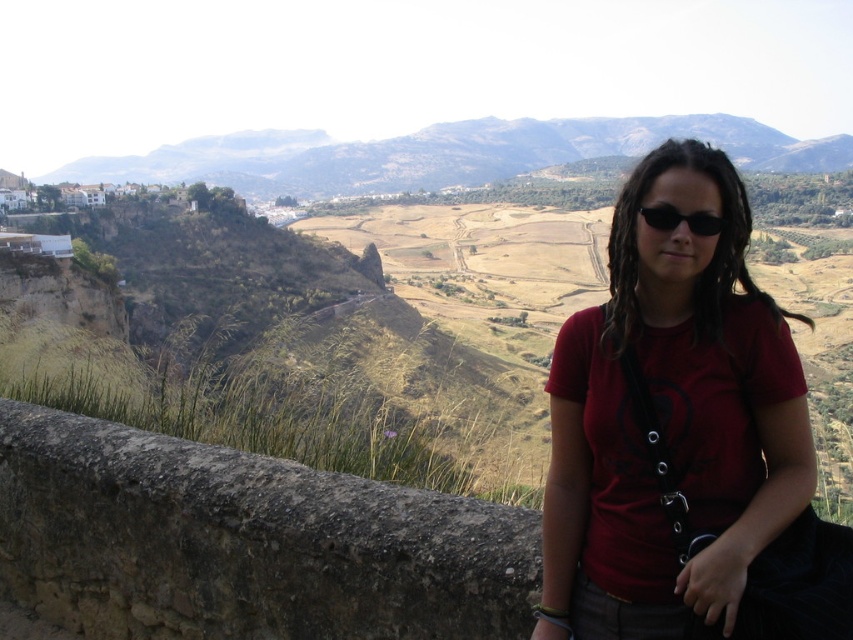
Question: Considering the real-world distances, which object is closest to the black matte sunglasses at center?

Choices:
 (A) rugged brown mountain at upper center
 (B) matte red t-shirt at center

Answer: (B)

Question: Is matte red t-shirt at center closer to camera compared to rugged brown mountain at upper center?

Choices:
 (A) no
 (B) yes

Answer: (B)

Question: Does matte red t-shirt at center have a smaller size compared to rugged brown mountain at upper center?

Choices:
 (A) no
 (B) yes

Answer: (B)

Question: Which point appears farthest from the camera in this image?

Choices:
 (A) click(x=685, y=218)
 (B) click(x=453, y=170)
 (C) click(x=664, y=144)

Answer: (B)

Question: Can you confirm if matte red t-shirt at center is positioned below rugged brown mountain at upper center?

Choices:
 (A) yes
 (B) no

Answer: (A)

Question: Among these points, which one is farthest from the camera?

Choices:
 (A) (624, 404)
 (B) (662, 211)
 (C) (315, 195)

Answer: (C)